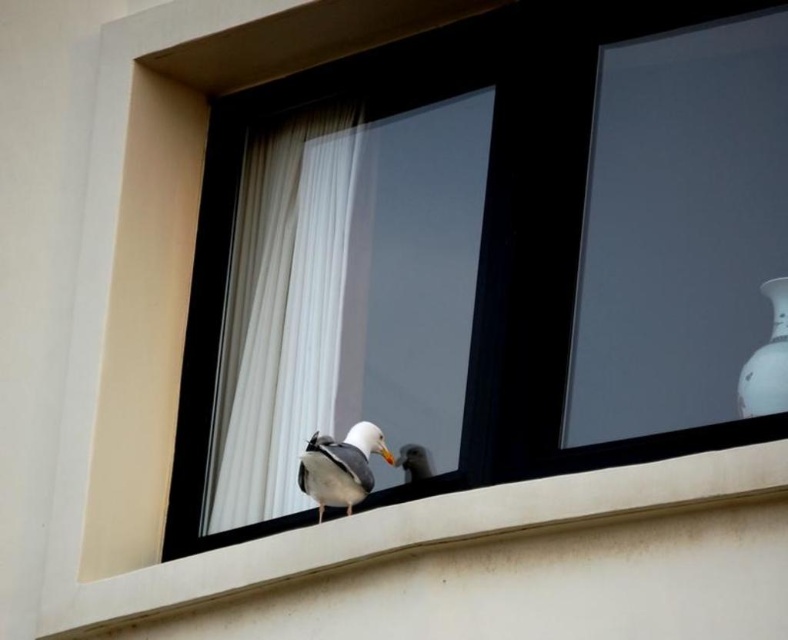
Between matte glass window at center and white feathered bird at center, which one has less height?

Standing shorter between the two is white feathered bird at center.

In the scene shown: Who is higher up, matte glass window at center or white feathered bird at center?

matte glass window at center is higher up.

Identify the location of matte glass window at center. This screenshot has height=640, width=788. (485, 256).

You are a GUI agent. You are given a task and a screenshot of the screen. Output one action in this format:
    pyautogui.click(x=<x>, y=<y>)
    Task: Click on the matte glass window at center
    The image size is (788, 640).
    Given the screenshot: What is the action you would take?
    pyautogui.click(x=485, y=256)

Can you confirm if white smooth concrete at center is thinner than white feathered bird at center?

No, white smooth concrete at center is not thinner than white feathered bird at center.

Who is positioned more to the left, white smooth concrete at center or white feathered bird at center?

From the viewer's perspective, white smooth concrete at center appears more on the left side.

Describe the element at coordinates (400, 532) in the screenshot. This screenshot has height=640, width=788. I see `white smooth concrete at center` at that location.

You are a GUI agent. You are given a task and a screenshot of the screen. Output one action in this format:
    pyautogui.click(x=<x>, y=<y>)
    Task: Click on the white smooth concrete at center
    This screenshot has width=788, height=640.
    Given the screenshot: What is the action you would take?
    pyautogui.click(x=400, y=532)

Which of these two, white matte bird at center or white feathered bird at center, stands shorter?

With less height is white feathered bird at center.

Does white matte bird at center have a greater height compared to white feathered bird at center?

Yes.

Describe the element at coordinates (340, 467) in the screenshot. I see `white matte bird at center` at that location.

The width and height of the screenshot is (788, 640). Identify the location of white matte bird at center. (340, 467).